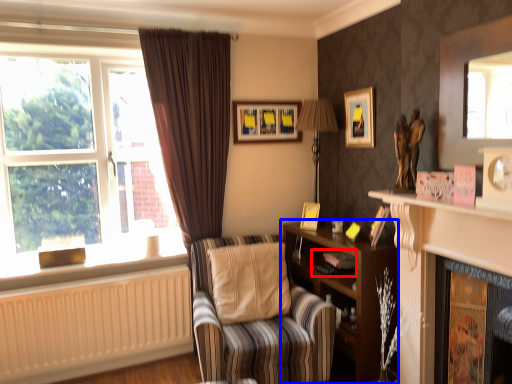
Question: Which object appears closest to the camera in this image, book (highlighted by a red box) or shelf (highlighted by a blue box)?

Choices:
 (A) book
 (B) shelf

Answer: (B)